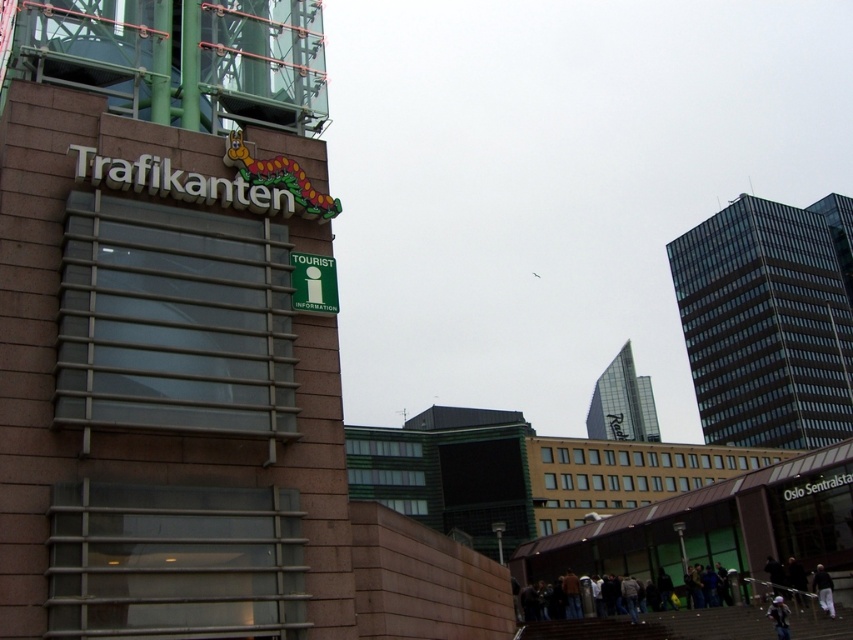
Question: Which object appears farthest from the camera in this image?

Choices:
 (A) glassy silver tower at upper right
 (B) dark blue jeans at lower right

Answer: (A)

Question: Which object is positioned farthest from the brown brick building at upper left?

Choices:
 (A) dark blue jeans at lower right
 (B) white cotton shirt at lower right
 (C) glassy black skyscraper at right

Answer: (C)

Question: Which object appears closest to the camera in this image?

Choices:
 (A) brown brick building at upper left
 (B) glassy silver tower at upper right
 (C) dark blue jeans at lower right

Answer: (A)

Question: Is glassy black skyscraper at right wider than glassy silver tower at upper right?

Choices:
 (A) no
 (B) yes

Answer: (B)

Question: Does glassy black skyscraper at right have a smaller size compared to white cotton shirt at lower right?

Choices:
 (A) no
 (B) yes

Answer: (A)

Question: Does white cotton shirt at lower right appear over dark blue jeans at lower right?

Choices:
 (A) yes
 (B) no

Answer: (A)